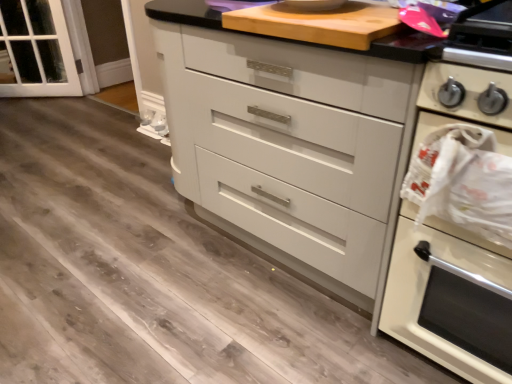
Where is `free region under clear glass door at left (from a real-world perspective)`? free region under clear glass door at left (from a real-world perspective) is located at coordinates (42, 91).